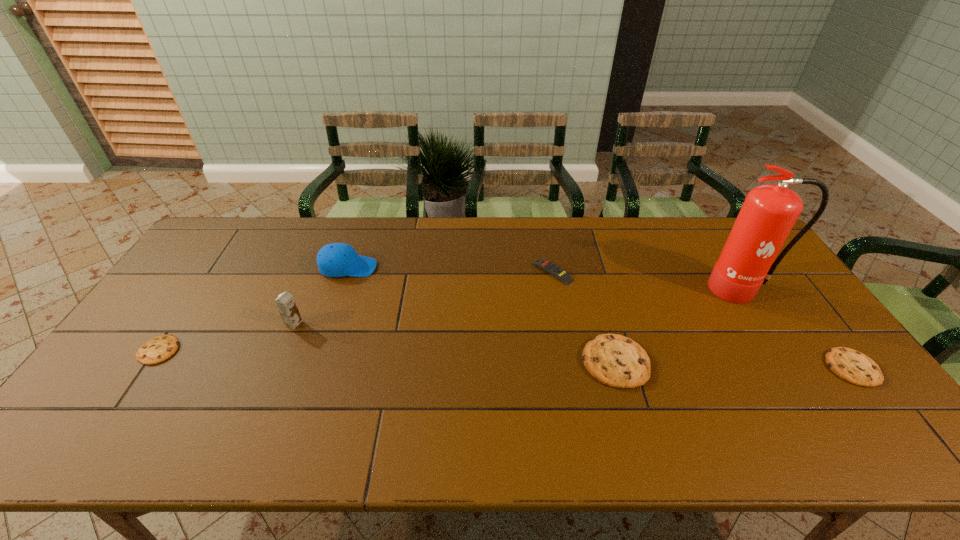
Identify the location of blank region between the remote control and the tallest object. The height and width of the screenshot is (540, 960). click(648, 280).

At what (x,y) coordinates should I click in order to perform the action: click on free space between the tallest cookie and the tallest object. Please return your answer as a coordinate pair (x, y). Looking at the image, I should click on (679, 325).

This screenshot has height=540, width=960. Identify the location of vacant area between the fourth nearest object and the rightmost cookie. coord(573,346).

The width and height of the screenshot is (960, 540). Find the location of `vacant space that's between the rightmost cookie and the chocolate milk`. vacant space that's between the rightmost cookie and the chocolate milk is located at coordinates (573, 346).

Where is `free space between the third tallest object and the shortest object`? This screenshot has width=960, height=540. free space between the third tallest object and the shortest object is located at coordinates (253, 309).

This screenshot has height=540, width=960. Identify the location of object that is the nearest to the fire extinguisher. (850, 365).

Identify which object is the fourth nearest to the leftmost cookie. Please provide its 2D coordinates. Your answer should be formatted as a tuple, i.e. [(x, y)], where the tuple contains the x and y coordinates of a point satisfying the conditions above.

[(615, 360)]

At what (x,y) coordinates should I click in order to perform the action: click on the closest cookie to the tallest object. Please return your answer as a coordinate pair (x, y). This screenshot has width=960, height=540. Looking at the image, I should click on [x=850, y=365].

Locate an element on the screen. Image resolution: width=960 pixels, height=540 pixels. cookie that stands as the third closest to the chocolate milk is located at coordinates (850, 365).

Where is `free space that satisfies the following two spatial constraints: 1. on the front-facing side of the cap; 2. on the right side of the remote control`? The width and height of the screenshot is (960, 540). free space that satisfies the following two spatial constraints: 1. on the front-facing side of the cap; 2. on the right side of the remote control is located at coordinates (347, 272).